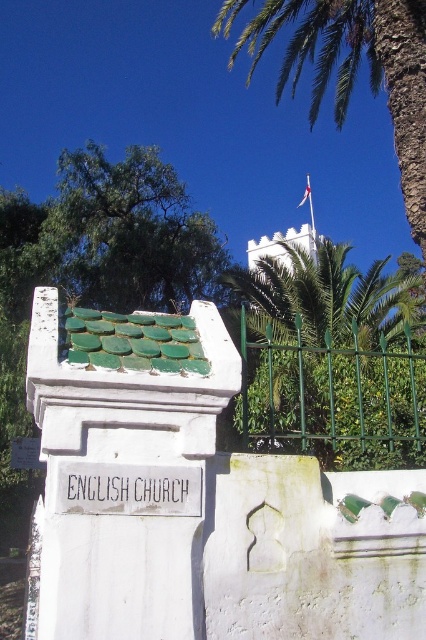
Consider the image. Who is positioned more to the left, green metal fence at upper center or green leafy palm tree at upper center?

green metal fence at upper center is more to the left.

Can you confirm if green metal fence at upper center is shorter than green leafy palm tree at upper center?

Correct, green metal fence at upper center is not as tall as green leafy palm tree at upper center.

Is point (253, 381) positioned in front of point (416, 209)?

No, (253, 381) is further to viewer.

The image size is (426, 640). I want to click on green metal fence at upper center, so click(333, 400).

Who is lower down, green leafy tree at upper left or green metal fence at upper center?

green metal fence at upper center is below.

Who is shorter, green leafy tree at upper left or green metal fence at upper center?

green leafy tree at upper left is shorter.

This screenshot has width=426, height=640. Describe the element at coordinates (129, 232) in the screenshot. I see `green leafy tree at upper left` at that location.

Where is `green leafy tree at upper left`? green leafy tree at upper left is located at coordinates (129, 232).

Locate an element on the screen. Image resolution: width=426 pixels, height=640 pixels. green leafy palm tree at upper center is located at coordinates (356, 70).

Which is above, green leafy palm tree at upper center or white fabric flag at upper center?

green leafy palm tree at upper center is above.

Between point (311, 90) and point (301, 202), which one is positioned behind?

Point (311, 90)

Locate an element on the screen. The height and width of the screenshot is (640, 426). green leafy palm tree at upper center is located at coordinates (356, 70).